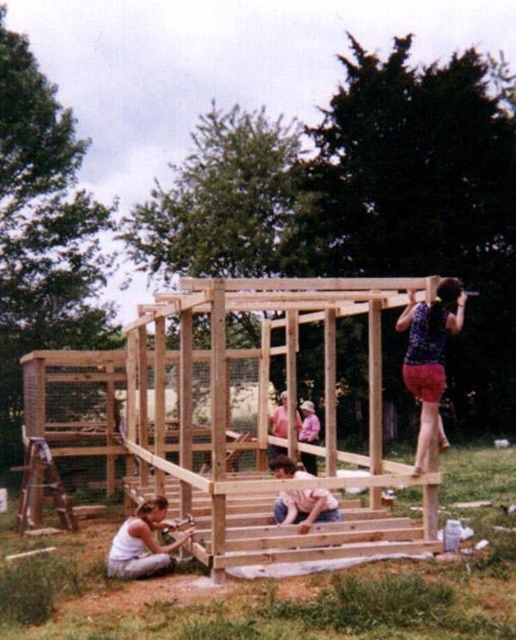
Between point (298, 504) and point (311, 460), which one is positioned behind?

Point (311, 460)

Is pink cotton shirt at center positioned before pink fabric shirt at center?

Yes, it is.

Between point (284, 509) and point (303, 452), which one is positioned in front?

Point (284, 509)

Identify the location of pink cotton shirt at center. (305, 508).

Who is more forward, (250,449) or (277,465)?

Point (277,465) is more forward.

Is light brown wood frame at center to the left of pink cotton shirt at center from the viewer's perspective?

Indeed, light brown wood frame at center is positioned on the left side of pink cotton shirt at center.

Is point (184, 364) positioned behind point (295, 465)?

No.

This screenshot has height=640, width=516. I want to click on light brown wood frame at center, so click(233, 422).

Who is positioned more to the left, light brown wood frame at center or spotted fabric shorts at upper right?

Positioned to the left is light brown wood frame at center.

Which is behind, point (156, 445) or point (450, 326)?

Positioned behind is point (156, 445).

Describe the element at coordinates (233, 422) in the screenshot. I see `light brown wood frame at center` at that location.

What are the coordinates of `light brown wood frame at center` in the screenshot? It's located at (233, 422).